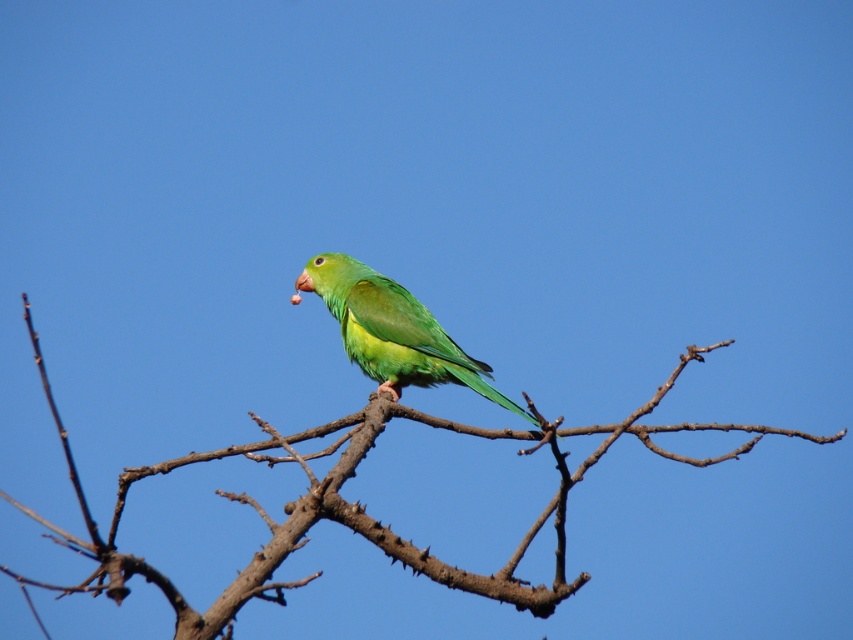
From the picture: You are standing at the origin point in the image. There are two points marked in the scene. Which point is closer to you, point (521, 547) or point (349, 280)?

Point (521, 547) is in front of point (349, 280), so it is closer to you.